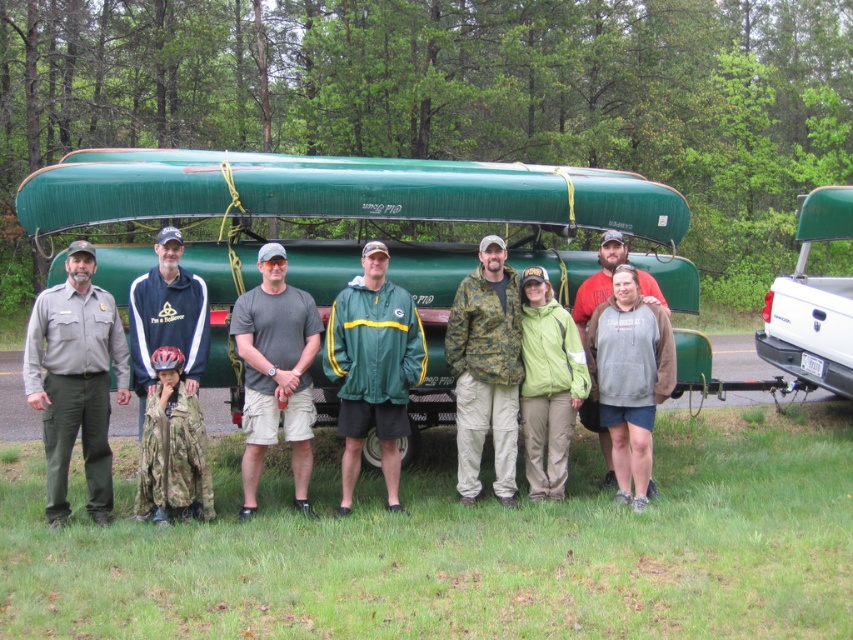
You are standing in the grassy area near the forest. You see the green matte boat at center and the white matte truck at upper right. Which one is closer to the ground?

The green matte boat at center is closer to the ground because it is below the white matte truck at upper right.

Looking at this image, you are planning to take a photo of the group with the green matte boat at center and the green matte jacket at center in the background. Which object should be closer to the camera to ensure both are in focus?

The green matte boat at center is not as tall as the green matte jacket at center. To ensure both are in focus, position the green matte jacket at center closer to the camera so that their heights align within the frame.